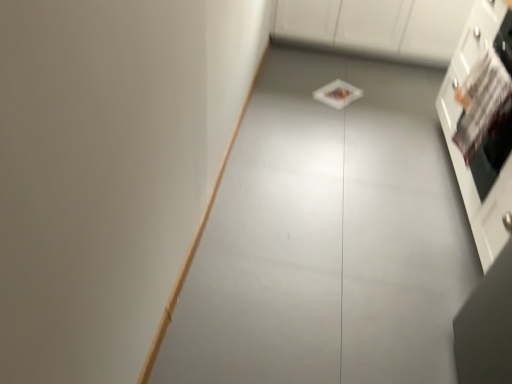
Question: Is white glossy cabinet at upper center, arranged as the second cabinetry when viewed from the front, turned away from white glossy cabinet at right, the second cabinetry viewed from the back?

Choices:
 (A) no
 (B) yes

Answer: (A)

Question: From the image's perspective, does white glossy cabinet at upper center, the second cabinetry from the bottom, appear lower than white glossy cabinet at right, marked as the 1th cabinetry in a front-to-back arrangement?

Choices:
 (A) no
 (B) yes

Answer: (A)

Question: Does white glossy cabinet at upper center, the second cabinetry from the bottom, lie behind white glossy cabinet at right, which is the 1th cabinetry from bottom to top?

Choices:
 (A) yes
 (B) no

Answer: (A)

Question: Is white glossy cabinet at upper center, the second cabinetry from the bottom, far from white glossy cabinet at right, the second cabinetry from the top?

Choices:
 (A) no
 (B) yes

Answer: (B)

Question: Does white glossy cabinet at upper center, the second cabinetry from the bottom, have a lesser height compared to white glossy cabinet at right, the second cabinetry viewed from the back?

Choices:
 (A) no
 (B) yes

Answer: (B)

Question: Is white glossy cabinet at upper center, the second cabinetry from the bottom, oriented towards white glossy cabinet at right, marked as the 1th cabinetry in a front-to-back arrangement?

Choices:
 (A) yes
 (B) no

Answer: (A)

Question: From a real-world perspective, is white glossy cabinet at right, which is the 1th cabinetry from bottom to top, over white glossy cabinet at upper center, which is the first cabinetry from top to bottom?

Choices:
 (A) yes
 (B) no

Answer: (A)

Question: Is the depth of white glossy cabinet at right, marked as the 1th cabinetry in a front-to-back arrangement, less than that of white glossy cabinet at upper center, which is the first cabinetry from top to bottom?

Choices:
 (A) yes
 (B) no

Answer: (A)

Question: Considering the relative sizes of white glossy cabinet at right, the second cabinetry from the top, and white glossy cabinet at upper center, which is counted as the first cabinetry, starting from the back, in the image provided, is white glossy cabinet at right, the second cabinetry from the top, thinner than white glossy cabinet at upper center, which is counted as the first cabinetry, starting from the back,?

Choices:
 (A) yes
 (B) no

Answer: (A)

Question: Is white glossy cabinet at right, the second cabinetry viewed from the back, further to the viewer compared to white glossy cabinet at upper center, arranged as the second cabinetry when viewed from the front?

Choices:
 (A) no
 (B) yes

Answer: (A)

Question: Can you confirm if white glossy cabinet at right, marked as the 1th cabinetry in a front-to-back arrangement, is taller than white glossy cabinet at upper center, which is the first cabinetry from top to bottom?

Choices:
 (A) yes
 (B) no

Answer: (A)

Question: From the image's perspective, is white glossy cabinet at right, the second cabinetry viewed from the back, beneath white glossy cabinet at upper center, which is counted as the first cabinetry, starting from the back?

Choices:
 (A) no
 (B) yes

Answer: (B)

Question: Is point (503, 26) positioned closer to the camera than point (373, 4)?

Choices:
 (A) closer
 (B) farther

Answer: (A)